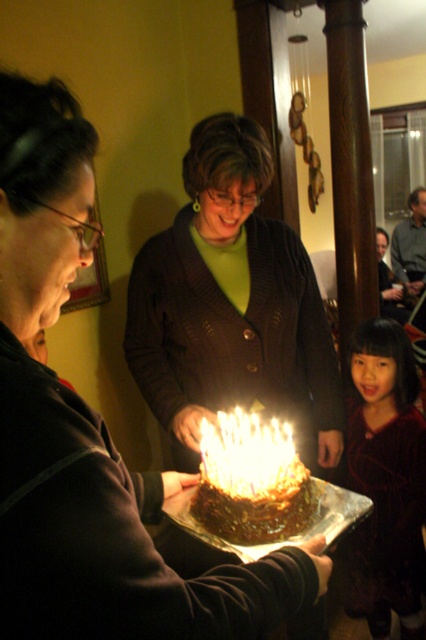
You are a photographer trying to capture the birthday cake with both the dark brown sweater at center and the golden wax candle at center in the frame. Which object will appear bigger in the photo?

The dark brown sweater at center will appear bigger in the photo because it has a larger size compared to the golden wax candle at center.

You are a photographer setting up for a birthday photo. You have to decide whether the velvet dark dress at lower right will block the golden wax candle at center in the frame. Based on their sizes, can the candle still be seen clearly?

The velvet dark dress at lower right is bigger than the golden wax candle at center, so it might block the candle depending on their positions. However, since the candle is at the center and the dress is at the lower right, there is a possibility that the candle remains visible. To ensure clarity, adjust the camera angle to avoid overlap.

You are a photographer setting up for a birthday photo. You need to ensure the dark brown sweater at center and the golden wax candle at center are both visible in the frame. Based on their positions, which object should you focus on first to ensure both are in focus?

The dark brown sweater at center is located above the golden wax candle at center. To ensure both are in focus, you should focus on the dark brown sweater at center first since it is closer to the camera, allowing the candle below to remain in focus as well.